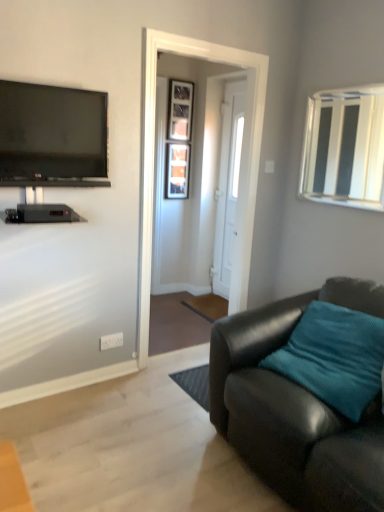
The image size is (384, 512). Describe the element at coordinates (52, 136) in the screenshot. I see `flat screen tv at upper left` at that location.

In order to face flat screen tv at upper left, should I rotate leftwards or rightwards?

To face it directly, rotate left by 17.849 degrees.

What do you see at coordinates (177, 170) in the screenshot? The width and height of the screenshot is (384, 512). I see `wooden frame at center, marked as the second window in a right-to-left arrangement` at bounding box center [177, 170].

Measure the distance between white glossy door at center and camera.

white glossy door at center and camera are 3.69 meters apart from each other.

Find the location of a particular element. white glossy door at center is located at coordinates (228, 185).

The width and height of the screenshot is (384, 512). What do you see at coordinates (335, 359) in the screenshot? I see `teal fabric pillow at lower right` at bounding box center [335, 359].

What do you see at coordinates (154, 155) in the screenshot?
I see `white glossy door at center` at bounding box center [154, 155].

Identify the location of matte black couch at lower right. (295, 409).

Looking at this image, is there a large distance between white plastic window at upper right, the first window positioned from the right, and white glossy door at center?

No, white plastic window at upper right, the first window positioned from the right, is in close proximity to white glossy door at center.

Looking at this image, is white glossy door at center a part of white plastic window at upper right, which is the 2th window from left to right?

No, white glossy door at center is located outside of white plastic window at upper right, which is the 2th window from left to right.

Looking at this image, considering the sizes of white plastic window at upper right, which is the second window in back-to-front order, and white glossy door at center in the image, is white plastic window at upper right, which is the second window in back-to-front order, taller or shorter than white glossy door at center?

Considering their sizes, white plastic window at upper right, which is the second window in back-to-front order, has less height than white glossy door at center.

Looking at the image, does white plastic window at upper right, the first window when ordered from front to back, seem bigger or smaller compared to white glossy door at center?

In the image, white plastic window at upper right, the first window when ordered from front to back, appears to be smaller than white glossy door at center.

Is white glossy door at center in contact with white glossy door at center?

No, white glossy door at center is not with white glossy door at center.

Considering the relative sizes of white glossy door at center and white glossy door at center in the image provided, is white glossy door at center shorter than white glossy door at center?

Yes.

Is white glossy door at center turned away from white glossy door at center?

No.

Is white glossy door at center smaller than flat screen tv at upper left?

Actually, white glossy door at center might be larger than flat screen tv at upper left.

Is flat screen tv at upper left completely or partially inside white glossy door at center?

No, flat screen tv at upper left is not surrounded by white glossy door at center.

How many degrees apart are the facing directions of white glossy door at center and flat screen tv at upper left?

The angular difference between white glossy door at center and flat screen tv at upper left is 91 degrees.

Is white glossy door at center facing away from flat screen tv at upper left?

That's not correct — white glossy door at center is not looking away from flat screen tv at upper left.

Can you tell me how much white glossy door at center and wooden frame at center, which is counted as the 2th window, starting from the front, differ in facing direction?

86.3 degrees separate the facing orientations of white glossy door at center and wooden frame at center, which is counted as the 2th window, starting from the front.

This screenshot has height=512, width=384. Identify the location of window behind the white glossy door at center. (177, 170).

Between white glossy door at center and wooden frame at center, placed as the first window when sorted from left to right, which one is positioned in front?

Positioned in front is white glossy door at center.

Visually, is matte black couch at lower right positioned to the left or to the right of flat screen tv at upper left?

From the image, it's evident that matte black couch at lower right is to the right of flat screen tv at upper left.

Considering the points (349, 301) and (16, 168), which point is behind, point (349, 301) or point (16, 168)?

The point (349, 301) is farther.

Which object is wider, matte black couch at lower right or wooden frame at center, which is counted as the 2th window, starting from the front?

matte black couch at lower right.

In the image, is matte black couch at lower right positioned in front of or behind wooden frame at center, placed as the first window when sorted from left to right?

Visually, matte black couch at lower right is located in front of wooden frame at center, placed as the first window when sorted from left to right.

Looking at this image, from the image's perspective, is matte black couch at lower right located above wooden frame at center, placed as the first window when sorted from left to right?

Actually, matte black couch at lower right appears below wooden frame at center, placed as the first window when sorted from left to right, in the image.

Could you tell me if matte black couch at lower right is turned towards wooden frame at center, arranged as the first window when viewed from the back?

No, matte black couch at lower right is not facing towards wooden frame at center, arranged as the first window when viewed from the back.

Does point (306, 142) come closer to viewer compared to point (175, 152)?

That is True.

Looking at this image, is white plastic window at upper right, the first window positioned from the right, taller or shorter than wooden frame at center, which is counted as the 2th window, starting from the front?

In the image, white plastic window at upper right, the first window positioned from the right, appears to be taller than wooden frame at center, which is counted as the 2th window, starting from the front.

Choose the correct answer: Is white plastic window at upper right, which is the second window in back-to-front order, inside wooden frame at center, arranged as the first window when viewed from the back, or outside it?

white plastic window at upper right, which is the second window in back-to-front order, exists outside the volume of wooden frame at center, arranged as the first window when viewed from the back.

Find the location of a particular element. the 2nd window above the white glossy door at center (from a real-world perspective) is located at coordinates (344, 148).

Locate an element on the screen. This screenshot has width=384, height=512. door behind the white glossy door at center is located at coordinates (228, 185).

When comparing their distances from teal fabric pillow at lower right, does wooden frame at center, placed as the first window when sorted from left to right, or white glossy door at center seem further?

Based on the image, wooden frame at center, placed as the first window when sorted from left to right, appears to be further to teal fabric pillow at lower right.

Which object lies further to the anchor point flat screen tv at upper left, white plastic power outlet at lower center or matte black couch at lower right?

matte black couch at lower right lies further to flat screen tv at upper left than the other object.

Which object lies nearer to the anchor point wooden frame at center, placed as the first window when sorted from left to right, white glossy door at center or teal fabric pillow at lower right?

white glossy door at center.

From the image, which object appears to be nearer to white plastic power outlet at lower center, white glossy door at center or matte black couch at lower right?

Based on the image, white glossy door at center appears to be nearer to white plastic power outlet at lower center.

Looking at the image, which one is located further to white glossy door at center, white plastic window at upper right, the first window positioned from the right, or flat screen tv at upper left?

white plastic window at upper right, the first window positioned from the right.

From the image, which object appears to be nearer to wooden frame at center, arranged as the first window when viewed from the back, white plastic power outlet at lower center or teal fabric pillow at lower right?

white plastic power outlet at lower center is positioned closer to the anchor wooden frame at center, arranged as the first window when viewed from the back.

Based on their spatial positions, is teal fabric pillow at lower right or matte black couch at lower right further from white plastic power outlet at lower center?

teal fabric pillow at lower right lies further to white plastic power outlet at lower center than the other object.

Considering their positions, is white plastic power outlet at lower center positioned closer to wooden frame at center, arranged as the first window when viewed from the back, than white glossy door at center?

white glossy door at center is positioned closer to the anchor wooden frame at center, arranged as the first window when viewed from the back.

Where is `studio couch between white plastic power outlet at lower center and white plastic window at upper right, which is the 2th window from left to right, in the horizontal direction`? This screenshot has height=512, width=384. studio couch between white plastic power outlet at lower center and white plastic window at upper right, which is the 2th window from left to right, in the horizontal direction is located at coordinates (295, 409).

This screenshot has width=384, height=512. Find the location of `pillow between flat screen tv at upper left and white plastic window at upper right, which is the 2th window from left to right`. pillow between flat screen tv at upper left and white plastic window at upper right, which is the 2th window from left to right is located at coordinates (335, 359).

At what (x,y) coordinates should I click in order to perform the action: click on screen door positioned between matte black couch at lower right and white plastic power outlet at lower center from near to far. Please return your answer as a coordinate pair (x, y). This screenshot has height=512, width=384. Looking at the image, I should click on (154, 155).

This screenshot has height=512, width=384. I want to click on power outlet located between white plastic window at upper right, which is the second window in back-to-front order, and white glossy door at center in the depth direction, so click(x=111, y=341).